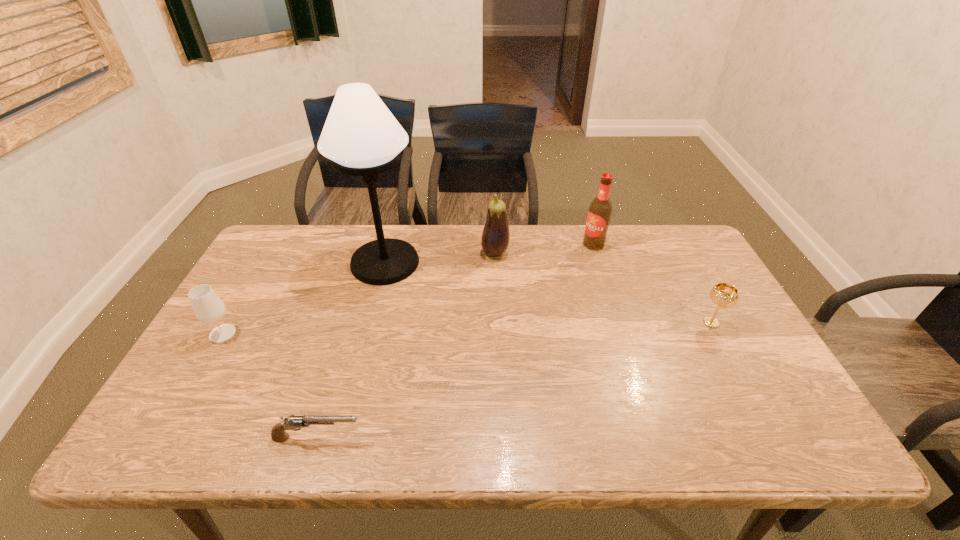
Locate an element on the screen. The image size is (960, 540). the tallest object is located at coordinates (361, 137).

The height and width of the screenshot is (540, 960). In order to click on beer bottle in this screenshot , I will do `click(599, 214)`.

At what (x,y) coordinates should I click in order to perform the action: click on the third object from right to left. Please return your answer as a coordinate pair (x, y). This screenshot has height=540, width=960. Looking at the image, I should click on (495, 237).

Where is `the leftmost object`? the leftmost object is located at coordinates (208, 308).

Where is `the third shortest object`? the third shortest object is located at coordinates (208, 308).

At what (x,y) coordinates should I click in order to perform the action: click on the fifth tallest object. Please return your answer as a coordinate pair (x, y). The height and width of the screenshot is (540, 960). Looking at the image, I should click on (725, 295).

I want to click on chalice, so click(x=725, y=295).

Where is `gun`? The image size is (960, 540). gun is located at coordinates (278, 434).

Find the location of a particular element. The width and height of the screenshot is (960, 540). the shortest object is located at coordinates (278, 434).

Find the location of `blank space located on the front of the tallest object`. blank space located on the front of the tallest object is located at coordinates (353, 387).